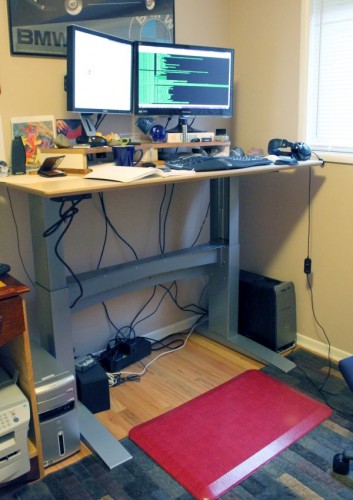
The height and width of the screenshot is (500, 353). I want to click on blue coffee mug, so click(x=126, y=153).